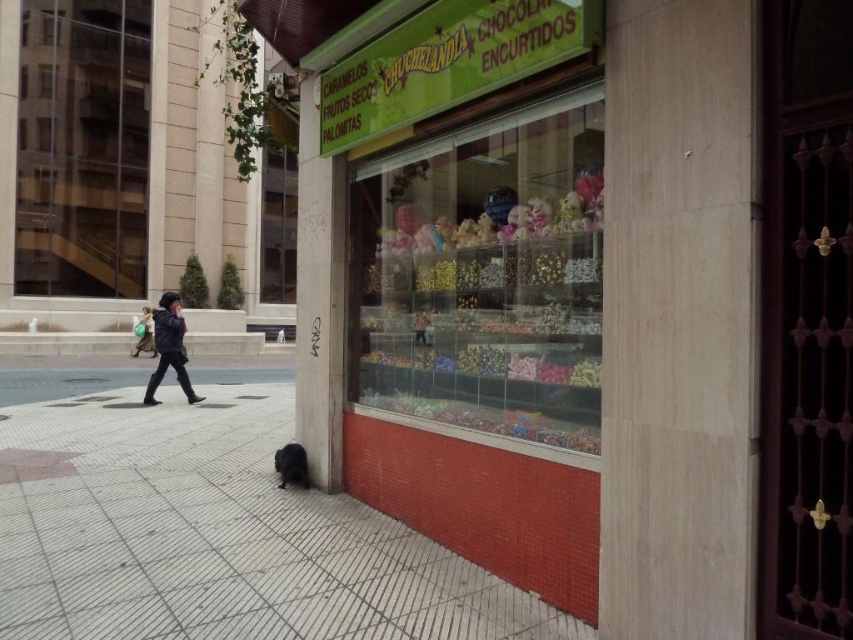
Question: Considering the real-world distances, which object is farthest from the black matte jacket at left?

Choices:
 (A) black tile pavement at lower left
 (B) clear glass display case at center
 (C) transparent glass at left

Answer: (C)

Question: Can you confirm if clear glass display case at center is positioned to the right of black leather jacket at left?

Choices:
 (A) yes
 (B) no

Answer: (A)

Question: Which object is positioned closest to the clear glass display case at center?

Choices:
 (A) black tile pavement at lower left
 (B) transparent glass at left
 (C) black leather jacket at left
 (D) black matte jacket at left

Answer: (A)

Question: Does clear glass display case at center have a lesser width compared to black matte jacket at left?

Choices:
 (A) no
 (B) yes

Answer: (A)

Question: Does black tile pavement at lower left have a smaller size compared to black leather jacket at left?

Choices:
 (A) no
 (B) yes

Answer: (B)

Question: Which object appears farthest from the camera in this image?

Choices:
 (A) clear glass display case at center
 (B) black matte jacket at left
 (C) black tile pavement at lower left
 (D) black leather jacket at left

Answer: (D)